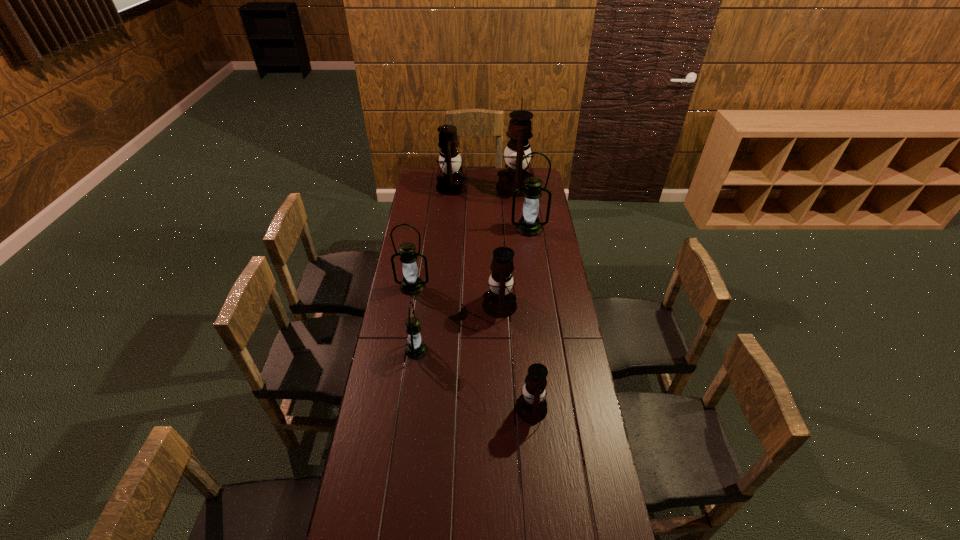
Locate an element on the screen. Image resolution: width=960 pixels, height=540 pixels. blank region between the tallest object and the rightmost green lantern is located at coordinates (522, 208).

Find the location of a particular element. The width and height of the screenshot is (960, 540). vacant area that lies between the second farthest green lantern and the tallest lantern is located at coordinates (464, 237).

At what (x,y) coordinates should I click in order to perform the action: click on free space between the second biggest green lantern and the nearest brown lantern. Please return your answer as a coordinate pair (x, y). Looking at the image, I should click on (472, 347).

Where is `empty location between the nearest brown lantern and the second smallest brown lantern`? Image resolution: width=960 pixels, height=540 pixels. empty location between the nearest brown lantern and the second smallest brown lantern is located at coordinates (516, 357).

Image resolution: width=960 pixels, height=540 pixels. Identify the location of free spot between the biggest brown lantern and the second smallest green lantern. click(464, 237).

Identify the location of free space between the fifth nearest object and the second farthest green lantern. This screenshot has height=540, width=960. (470, 258).

Where is `object that is the third nearest to the nearest lantern`? Image resolution: width=960 pixels, height=540 pixels. object that is the third nearest to the nearest lantern is located at coordinates (412, 284).

At what (x,y) coordinates should I click in order to perform the action: click on the fifth closest object to the sixth farthest object. Please return your answer as a coordinate pair (x, y). The image size is (960, 540). Looking at the image, I should click on (452, 182).

Locate an element on the screen. This screenshot has height=540, width=960. lantern that is the sixth closest to the third smallest brown lantern is located at coordinates (531, 407).

Locate which lantern is the third closest to the rightmost green lantern. Please provide its 2D coordinates. Your answer should be formatted as a tuple, i.e. [(x, y)], where the tuple contains the x and y coordinates of a point satisfying the conditions above.

[(499, 302)]